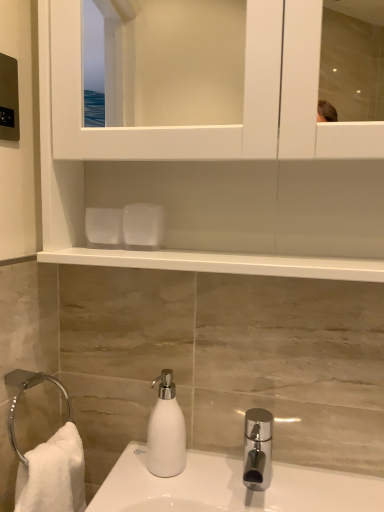
Question: Is white matte cabinet at upper center spatially inside white matte soap dispenser at lower center, or outside of it?

Choices:
 (A) inside
 (B) outside

Answer: (B)

Question: In terms of size, does white matte cabinet at upper center appear bigger or smaller than white matte soap dispenser at lower center?

Choices:
 (A) big
 (B) small

Answer: (A)

Question: Based on their positions, is white matte cabinet at upper center located to the left or right of white matte soap dispenser at lower center?

Choices:
 (A) right
 (B) left

Answer: (A)

Question: Looking at their shapes, would you say white matte soap dispenser at lower center is wider or thinner than white matte cabinet at upper center?

Choices:
 (A) wide
 (B) thin

Answer: (B)

Question: Is white matte soap dispenser at lower center situated inside white matte cabinet at upper center or outside?

Choices:
 (A) outside
 (B) inside

Answer: (A)

Question: Considering the positions of white matte soap dispenser at lower center and white matte cabinet at upper center in the image, is white matte soap dispenser at lower center taller or shorter than white matte cabinet at upper center?

Choices:
 (A) tall
 (B) short

Answer: (B)

Question: Relative to white matte cabinet at upper center, is white matte soap dispenser at lower center in front or behind?

Choices:
 (A) behind
 (B) front

Answer: (A)